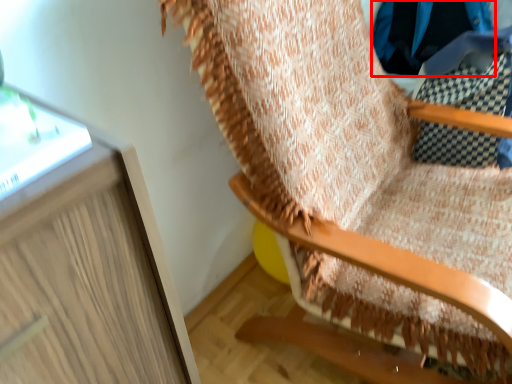
Question: From the image's perspective, where is clothing (annotated by the red box) located in relation to furniture in the image?

Choices:
 (A) below
 (B) above

Answer: (B)